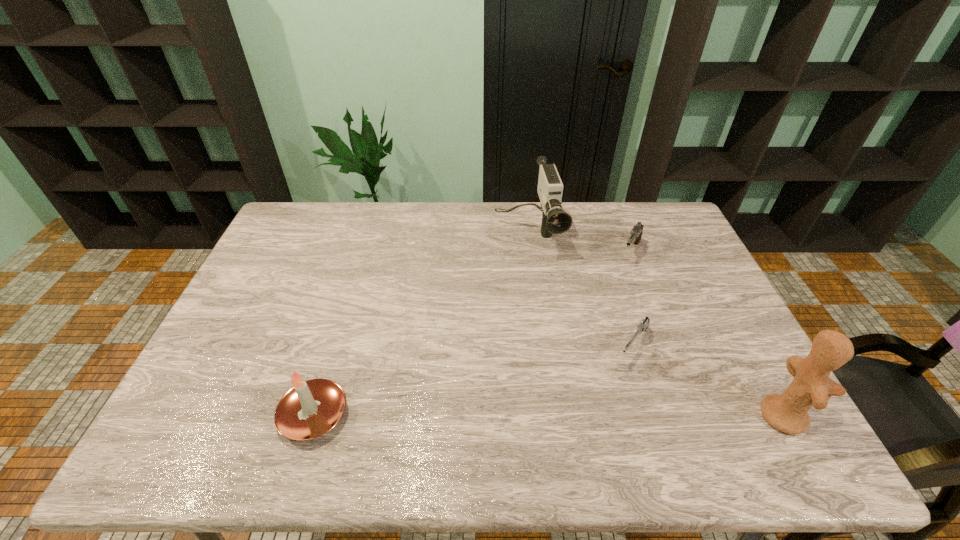
This screenshot has width=960, height=540. I want to click on vacant space at the far right corner, so click(641, 210).

At what (x,y) coordinates should I click in order to perform the action: click on free region at the near right corner. Please return your answer as a coordinate pair (x, y). The width and height of the screenshot is (960, 540). Looking at the image, I should click on (710, 386).

Where is `free space between the leftmost object and the third farthest object`? The width and height of the screenshot is (960, 540). free space between the leftmost object and the third farthest object is located at coordinates (474, 380).

This screenshot has width=960, height=540. Identify the location of empty location between the third tallest object and the third nearest object. click(x=474, y=380).

The height and width of the screenshot is (540, 960). I want to click on free space that is in between the candle and the farther pistol, so click(x=472, y=334).

Find the location of a particular element. This screenshot has width=960, height=540. free space between the fourth object from right to left and the third farthest object is located at coordinates (581, 290).

Locate an element on the screen. The width and height of the screenshot is (960, 540). vacant area between the figurine and the fourth tallest object is located at coordinates (706, 334).

The height and width of the screenshot is (540, 960). What are the coordinates of `free spot between the shortest object and the third tallest object` in the screenshot? It's located at (474, 380).

In order to click on empty space between the candle and the fourth tallest object in this screenshot , I will do `click(472, 334)`.

At what (x,y) coordinates should I click in order to perform the action: click on vacant point located between the fourth object from right to left and the third tallest object. Please return your answer as a coordinate pair (x, y). The image size is (960, 540). Looking at the image, I should click on (420, 325).